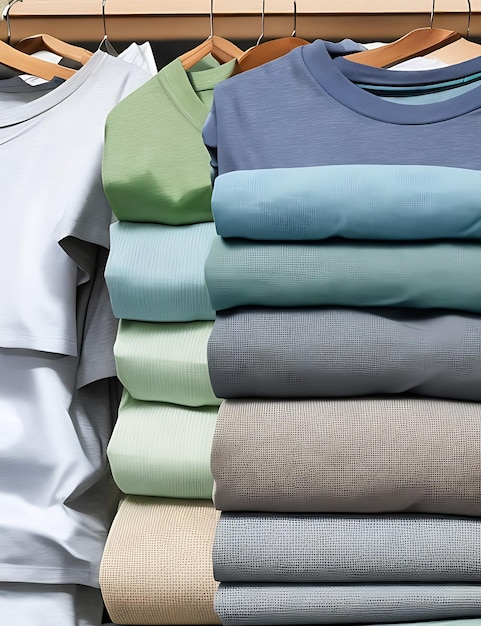
I want to click on hangers, so click(19, 59), click(110, 31), click(213, 29), click(261, 31), click(295, 27), click(432, 14), click(469, 19).